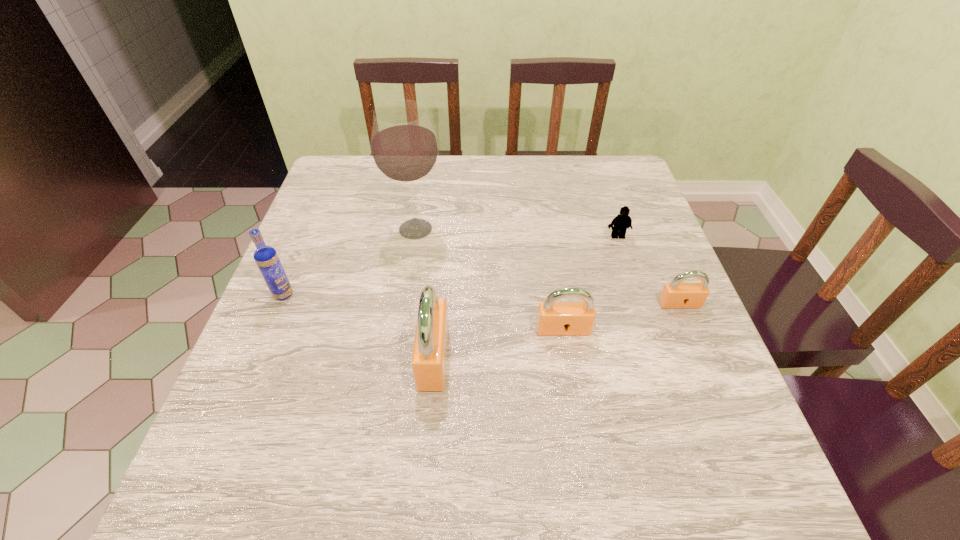
The image size is (960, 540). Find the location of `vacant space at the near edge of the desktop`. vacant space at the near edge of the desktop is located at coordinates (496, 403).

Identify the location of vacant space at the left edge. (330, 346).

The width and height of the screenshot is (960, 540). In the image, there is a desktop. What are the coordinates of `vacant space at the right edge` in the screenshot? It's located at (629, 262).

Image resolution: width=960 pixels, height=540 pixels. In the image, there is a desktop. Identify the location of free space at the far left corner. (339, 185).

In the image, there is a desktop. Identify the location of blank space at the far right corner. (592, 201).

At what (x,y) coordinates should I click in order to perform the action: click on free space between the alcohol and the third shortest object. Please return your answer as a coordinate pair (x, y). Looking at the image, I should click on [490, 279].

The image size is (960, 540). What are the coordinates of `free point between the fifth object from left to right and the leftmost padlock` in the screenshot? It's located at (526, 297).

Locate an element on the screen. vacant region between the third shortest object and the Lego is located at coordinates (590, 283).

Locate an element on the screen. free space that is in between the tallest object and the fifth object from left to right is located at coordinates (516, 233).

This screenshot has height=540, width=960. What are the coordinates of `empty location between the second shortest padlock and the tallest padlock` in the screenshot? It's located at (498, 343).